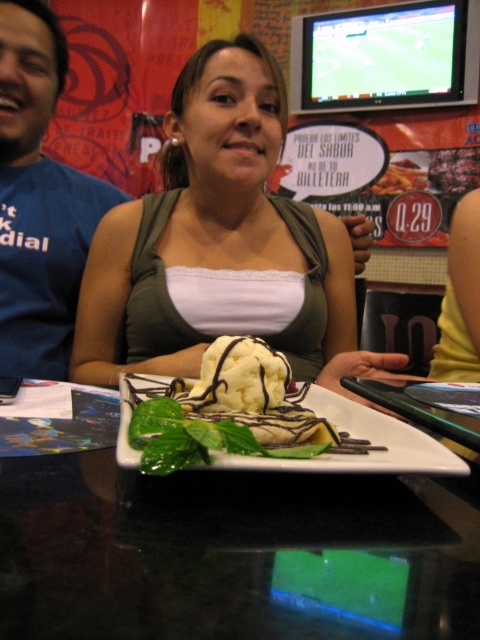
Who is taller, blue fabric shirt at left or yellow creamy ice cream at center?

Standing taller between the two is blue fabric shirt at left.

Can you confirm if blue fabric shirt at left is wider than yellow creamy ice cream at center?

Yes.

The image size is (480, 640). Find the location of `blue fabric shirt at left`. blue fabric shirt at left is located at coordinates (38, 200).

Which is above, matte green tank top at center or blue fabric shirt at left?

Positioned higher is blue fabric shirt at left.

Does matte green tank top at center appear on the left side of blue fabric shirt at left?

Incorrect, matte green tank top at center is not on the left side of blue fabric shirt at left.

Between point (181, 337) and point (43, 218), which one is positioned in front?

Point (181, 337) is in front.

Where is `matte green tank top at center`? matte green tank top at center is located at coordinates (216, 241).

Is white creamy ice cream at center smaller than yellow creamy ice cream at center?

No.

Which is more to the left, white creamy ice cream at center or yellow creamy ice cream at center?

white creamy ice cream at center is more to the left.

Where is `white creamy ice cream at center`? This screenshot has height=640, width=480. white creamy ice cream at center is located at coordinates (231, 404).